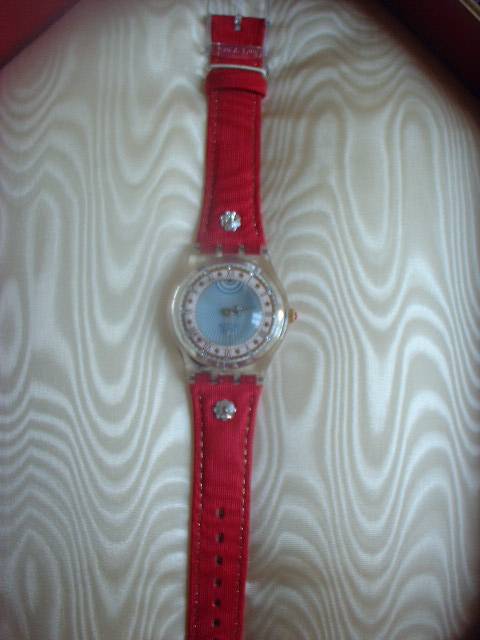
Locate an element on the screen. Image resolution: width=480 pixels, height=640 pixels. cushion is located at coordinates (378, 264).